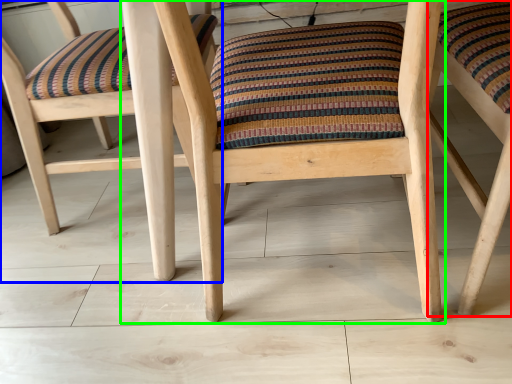
Question: Estimate the real-world distances between objects in this image. Which object is farther from chair (highlighted by a red box), chair (highlighted by a blue box) or chair (highlighted by a green box)?

Choices:
 (A) chair
 (B) chair

Answer: (A)